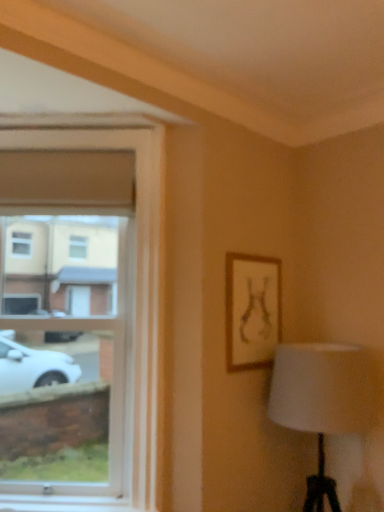
Question: Would you say wooden frame at upper right is to the left or to the right of clear glass window at left in the picture?

Choices:
 (A) right
 (B) left

Answer: (A)

Question: In terms of width, does wooden frame at upper right look wider or thinner when compared to clear glass window at left?

Choices:
 (A) thin
 (B) wide

Answer: (A)

Question: From the image's perspective, is wooden frame at upper right positioned above or below clear glass window at left?

Choices:
 (A) below
 (B) above

Answer: (A)

Question: From the image's perspective, is clear glass window at left located above or below wooden frame at upper right?

Choices:
 (A) above
 (B) below

Answer: (A)

Question: In the image, is clear glass window at left positioned in front of or behind wooden frame at upper right?

Choices:
 (A) front
 (B) behind

Answer: (A)

Question: Based on their positions, is clear glass window at left located to the left or right of wooden frame at upper right?

Choices:
 (A) left
 (B) right

Answer: (A)

Question: Is clear glass window at left bigger or smaller than wooden frame at upper right?

Choices:
 (A) small
 (B) big

Answer: (B)